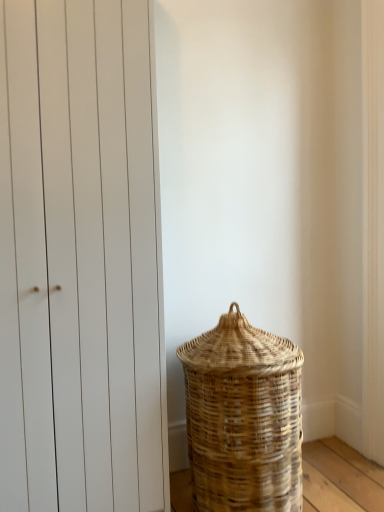
Describe the element at coordinates (80, 260) in the screenshot. This screenshot has height=512, width=384. I see `white matte door at left` at that location.

Where is `white matte door at left`? white matte door at left is located at coordinates (80, 260).

Measure the distance between white matte door at left and camera.

white matte door at left and camera are 4.26 feet apart from each other.

Measure the distance between point (116, 102) and camera.

The depth of point (116, 102) is 4.65 feet.

Describe the element at coordinates (243, 418) in the screenshot. I see `natural woven basket at lower right` at that location.

Locate an element on the screen. This screenshot has width=384, height=512. natural woven basket at lower right is located at coordinates (243, 418).

Where is `white matte door at left`? This screenshot has height=512, width=384. white matte door at left is located at coordinates [x=80, y=260].

Which object is positioned more to the left, white matte door at left or natural woven basket at lower right?

white matte door at left is more to the left.

Looking at this image, is white matte door at left further to the viewer compared to natural woven basket at lower right?

No.

Which is behind, point (115, 422) or point (220, 362)?

The point (220, 362) is farther from the camera.

From the image's perspective, who appears lower, white matte door at left or natural woven basket at lower right?

natural woven basket at lower right is shown below in the image.

From a real-world perspective, is white matte door at left positioned under natural woven basket at lower right based on gravity?

No.

Considering the sizes of objects white matte door at left and natural woven basket at lower right in the image provided, who is wider, white matte door at left or natural woven basket at lower right?

natural woven basket at lower right.

Which of these two, white matte door at left or natural woven basket at lower right, stands taller?

white matte door at left.

Who is smaller, white matte door at left or natural woven basket at lower right?

With smaller size is natural woven basket at lower right.

Is white matte door at left surrounding natural woven basket at lower right?

No, natural woven basket at lower right is located outside of white matte door at left.

Would you say white matte door at left is a long distance from natural woven basket at lower right?

white matte door at left is actually quite close to natural woven basket at lower right.

Could you tell me if white matte door at left is turned towards natural woven basket at lower right?

No, white matte door at left is not turned towards natural woven basket at lower right.

Locate an element on the screen. The width and height of the screenshot is (384, 512). door above the natural woven basket at lower right (from the image's perspective) is located at coordinates pyautogui.click(x=80, y=260).

Based on their positions, is natural woven basket at lower right located to the left or right of white matte door at left?

natural woven basket at lower right is to the right of white matte door at left.

Is natural woven basket at lower right positioned before white matte door at left?

No, it is not.

Considering the points (213, 350) and (26, 490), which point is in front, point (213, 350) or point (26, 490)?

Point (26, 490)

From the image's perspective, between natural woven basket at lower right and white matte door at left, who is located below?

natural woven basket at lower right is shown below in the image.

From a real-world perspective, which object rests below the other?

From a 3D spatial view, natural woven basket at lower right is below.

Does natural woven basket at lower right have a lesser width compared to white matte door at left?

No, natural woven basket at lower right is not thinner than white matte door at left.

Based on the photo, can you confirm if natural woven basket at lower right is shorter than white matte door at left?

Indeed, natural woven basket at lower right has a lesser height compared to white matte door at left.

Which of these two, natural woven basket at lower right or white matte door at left, is smaller?

natural woven basket at lower right is smaller.

Is natural woven basket at lower right not within white matte door at left?

Yes, natural woven basket at lower right is located beyond the bounds of white matte door at left.

Looking at this image, are natural woven basket at lower right and white matte door at left located far from each other?

No, there isn't a large distance between natural woven basket at lower right and white matte door at left.

Is natural woven basket at lower right oriented towards white matte door at left?

No, natural woven basket at lower right is not turned towards white matte door at left.

Consider the image. Can you tell me how much natural woven basket at lower right and white matte door at left differ in facing direction?

natural woven basket at lower right and white matte door at left are facing 0.000326 degrees away from each other.

Measure the distance between natural woven basket at lower right and white matte door at left.

A distance of 16.34 inches exists between natural woven basket at lower right and white matte door at left.

This screenshot has width=384, height=512. Identify the location of basket lying below the white matte door at left (from the image's perspective). (243, 418).

The image size is (384, 512). Identify the location of door positioned vertically above the natural woven basket at lower right (from a real-world perspective). (80, 260).

Identify the location of door above the natural woven basket at lower right (from the image's perspective). The width and height of the screenshot is (384, 512). (80, 260).